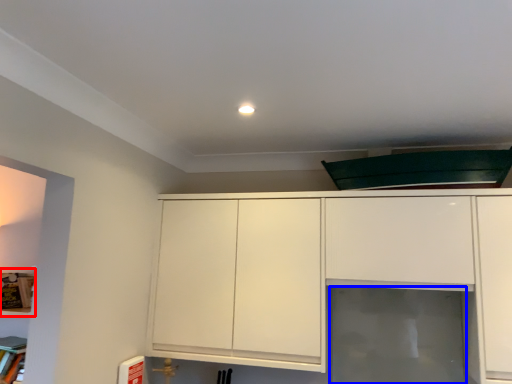
Question: Which of the following is the farthest to the observer, shelf (highlighted by a red box) or glass door (highlighted by a blue box)?

Choices:
 (A) shelf
 (B) glass door

Answer: (A)